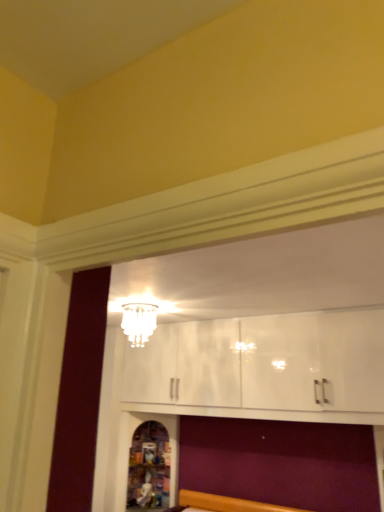
Question: Is white glass chandelier at upper center positioned before wooden carved statue at lower center?

Choices:
 (A) yes
 (B) no

Answer: (A)

Question: From a real-world perspective, is white glass chandelier at upper center over wooden carved statue at lower center?

Choices:
 (A) no
 (B) yes

Answer: (B)

Question: Could you tell me if white glass chandelier at upper center is facing wooden carved statue at lower center?

Choices:
 (A) no
 (B) yes

Answer: (A)

Question: Is white glass chandelier at upper center wider than wooden carved statue at lower center?

Choices:
 (A) yes
 (B) no

Answer: (B)

Question: Is white glass chandelier at upper center not close to wooden carved statue at lower center?

Choices:
 (A) no
 (B) yes

Answer: (B)

Question: Is the surface of white glass chandelier at upper center in direct contact with wooden carved statue at lower center?

Choices:
 (A) no
 (B) yes

Answer: (A)

Question: From the image's perspective, would you say wooden carved statue at lower center is shown under white glass chandelier at upper center?

Choices:
 (A) yes
 (B) no

Answer: (A)

Question: Considering the relative positions of wooden carved statue at lower center and white glass chandelier at upper center in the image provided, is wooden carved statue at lower center to the left of white glass chandelier at upper center from the viewer's perspective?

Choices:
 (A) no
 (B) yes

Answer: (B)

Question: Is white glass chandelier at upper center a part of wooden carved statue at lower center?

Choices:
 (A) yes
 (B) no

Answer: (B)

Question: Does wooden carved statue at lower center have a smaller size compared to white glass chandelier at upper center?

Choices:
 (A) yes
 (B) no

Answer: (B)

Question: From a real-world perspective, is wooden carved statue at lower center on top of white glass chandelier at upper center?

Choices:
 (A) yes
 (B) no

Answer: (B)

Question: Can you confirm if wooden carved statue at lower center is positioned to the right of white glass chandelier at upper center?

Choices:
 (A) no
 (B) yes

Answer: (A)

Question: Considering the positions of white glass chandelier at upper center and wooden carved statue at lower center in the image, is white glass chandelier at upper center taller or shorter than wooden carved statue at lower center?

Choices:
 (A) tall
 (B) short

Answer: (B)